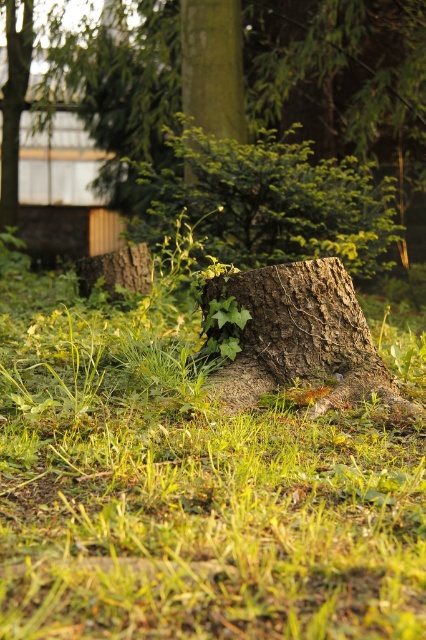
Is point (112, 83) less distant than point (307, 262)?

No, it is not.

Based on the photo, is smooth brown stump at center smaller than green mossy bark at center?

No, smooth brown stump at center is not smaller than green mossy bark at center.

Which is behind, point (149, 54) or point (377, 387)?

Point (149, 54)

I want to click on smooth brown stump at center, so point(340,77).

Does green grass at center appear under smooth brown stump at center?

Indeed, green grass at center is positioned under smooth brown stump at center.

Does green grass at center have a greater width compared to smooth brown stump at center?

Yes.

Measure the distance between point (411, 451) and camera.

A distance of 11.96 feet exists between point (411, 451) and camera.

Find the location of a particular element. This screenshot has height=640, width=426. green grass at center is located at coordinates (189, 486).

Who is taller, green grass at center or green mossy bark at center?

green mossy bark at center

Is point (227, 529) positioned behind point (238, 301)?

No, (227, 529) is closer to viewer.

Image resolution: width=426 pixels, height=640 pixels. What are the coordinates of `green grass at center` in the screenshot? It's located at (189, 486).